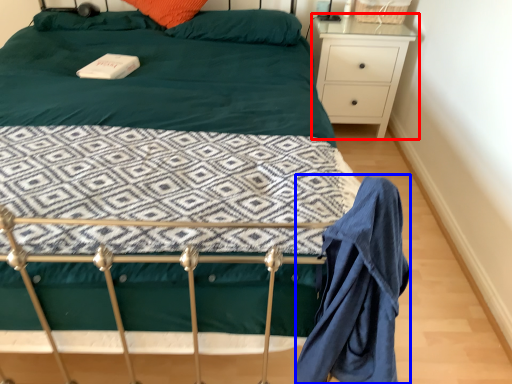
Question: Which object is closer to the camera taking this photo, nightstand (highlighted by a red box) or robe (highlighted by a blue box)?

Choices:
 (A) nightstand
 (B) robe

Answer: (B)